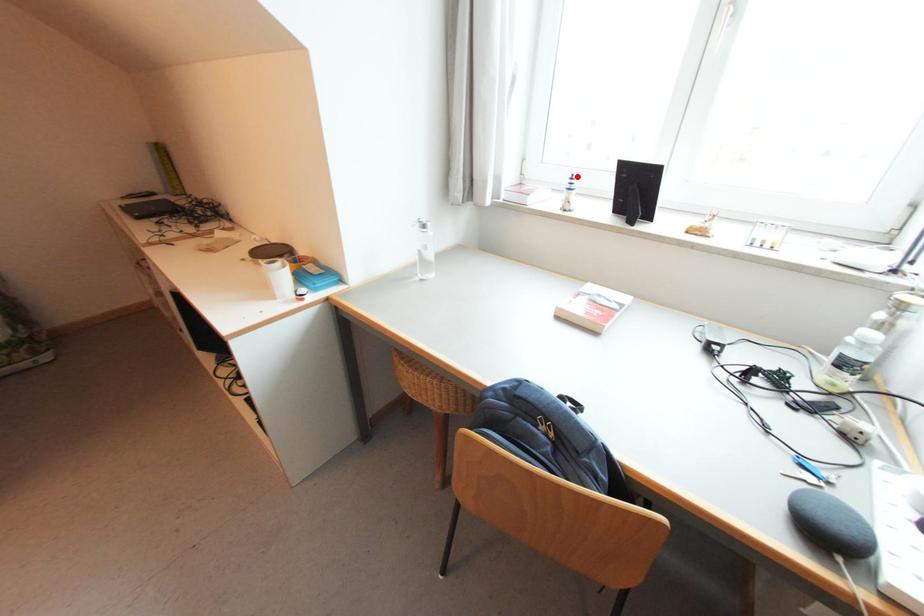
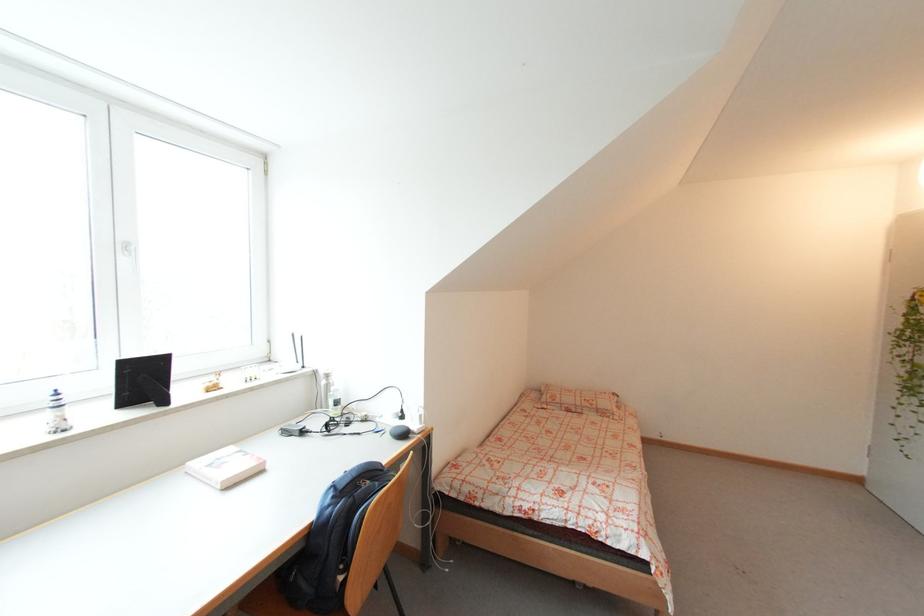
Find the pixel in the second image that matches the highlighted location in the first image.

(58, 392)